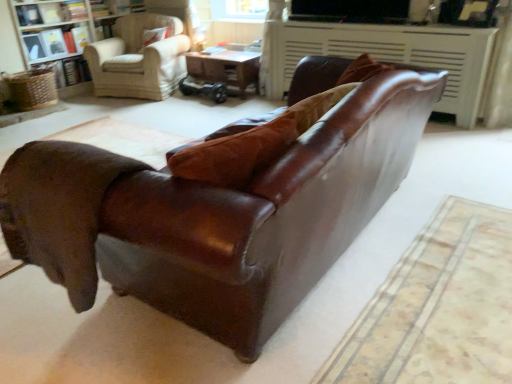
Question: In the image, is brown leather fireplace at upper center positioned in front of or behind light beige fabric armchair at upper left?

Choices:
 (A) front
 (B) behind

Answer: (A)

Question: Is point (272, 69) positioned closer to the camera than point (175, 26)?

Choices:
 (A) farther
 (B) closer

Answer: (B)

Question: Estimate the real-world distances between objects in this image. Which object is closer to the white textured bookcase at upper left?

Choices:
 (A) light beige fabric armchair at upper left
 (B) suede-like brown pillow at upper left
 (C) brown leather fireplace at upper center
 (D) shiny brown leather couch at center
 (E) wooden table at center

Answer: (A)

Question: Considering the real-world distances, which object is closest to the light beige fabric armchair at upper left?

Choices:
 (A) shiny brown leather couch at center
 (B) wooden table at center
 (C) brown leather fireplace at upper center
 (D) white textured bookcase at upper left
 (E) suede-like brown pillow at upper left

Answer: (E)